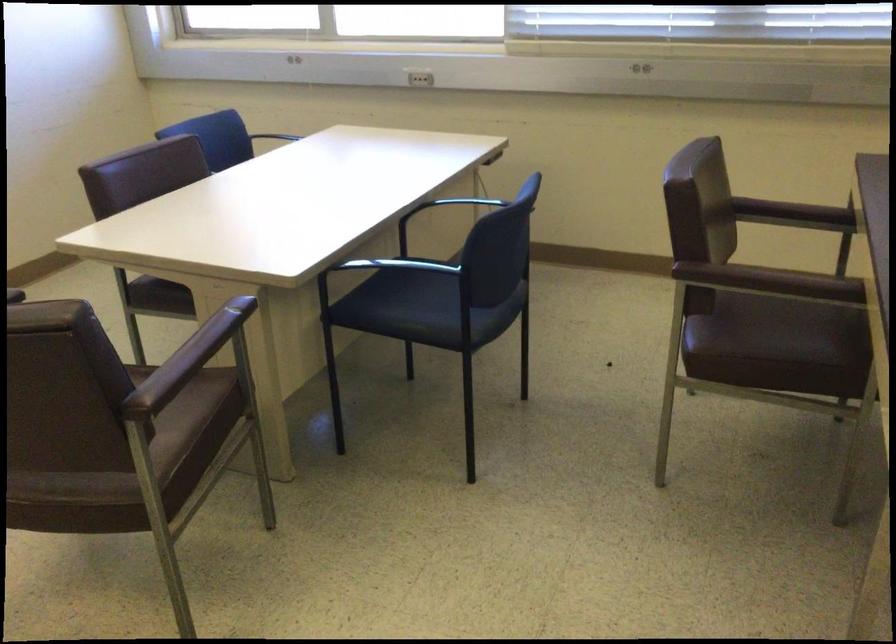
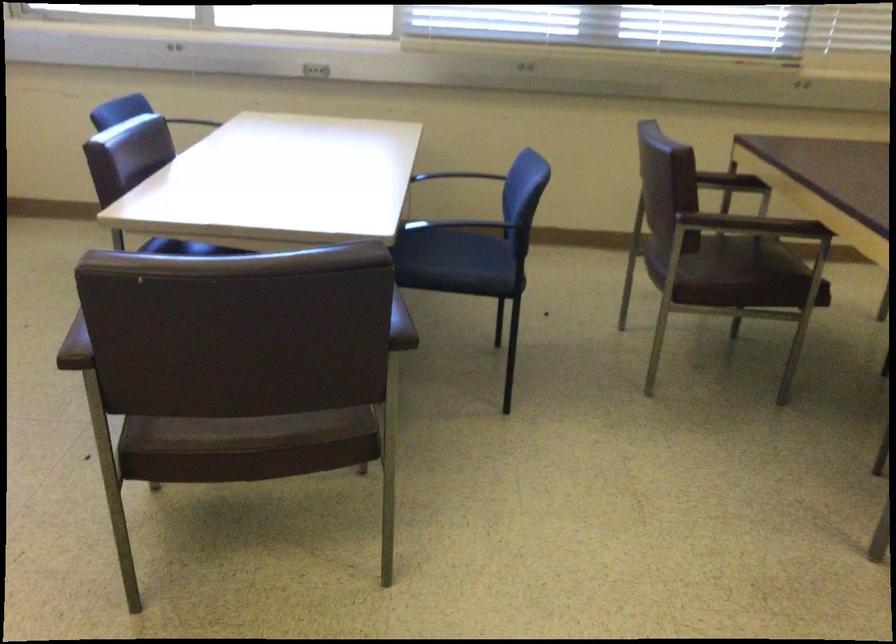
Locate, in the second image, the point that corresponds to the point at 772,346 in the first image.

(739, 278)